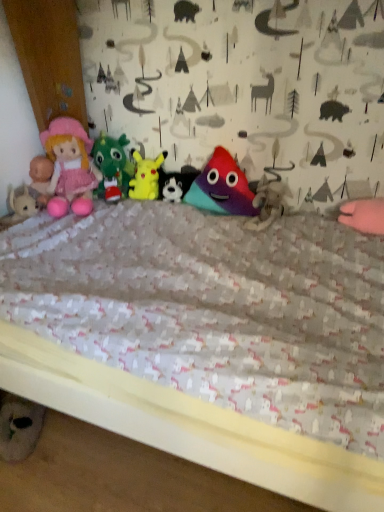
Find the location of a particular element. velvety green dragon at center, the 1th toy in the left-to-right sequence is located at coordinates (112, 167).

What do you see at coordinates (176, 183) in the screenshot?
I see `matte plastic pyramid at center, arranged as the 3th toy when viewed from the right` at bounding box center [176, 183].

What do you see at coordinates (267, 203) in the screenshot? Image resolution: width=384 pixels, height=512 pixels. I see `multicolored fabric triangle at center, acting as the 1th toy starting from the right` at bounding box center [267, 203].

What is the approximate width of pink plush doll at left?

31.16 centimeters.

What are the coordinates of `pink plush doll at left` in the screenshot? It's located at (70, 167).

This screenshot has height=512, width=384. What do you see at coordinates (222, 187) in the screenshot?
I see `multicolored plush triangle at center, which appears as the 4th toy when viewed from the left` at bounding box center [222, 187].

What is the approximate width of multicolored plush triangle at center, which appears as the 4th toy when viewed from the left?

The width of multicolored plush triangle at center, which appears as the 4th toy when viewed from the left, is 13.99 centimeters.

The height and width of the screenshot is (512, 384). Identify the location of velvety green dragon at center, which is counted as the 5th toy, starting from the right. (112, 167).

Is matte plastic pyramid at center, arranged as the 3th toy when viewed from the right, to the right of pink plush doll at left from the viewer's perspective?

Correct, you'll find matte plastic pyramid at center, arranged as the 3th toy when viewed from the right, to the right of pink plush doll at left.

Considering the points (193, 167) and (61, 122), which point is in front, point (193, 167) or point (61, 122)?

Positioned in front is point (61, 122).

Would you say pink plush doll at left is part of matte plastic pyramid at center, marked as the 3th toy in a left-to-right arrangement,'s contents?

Definitely not — pink plush doll at left is not inside matte plastic pyramid at center, marked as the 3th toy in a left-to-right arrangement.

Find the location of a particular element. the 3rd toy behind when counting from the pink plush doll at left is located at coordinates (176, 183).

Considering the sizes of objects yellow plush at center, which is the second toy in left-to-right order, and multicolored fabric triangle at center, which is counted as the fifth toy, starting from the left, in the image provided, who is wider, yellow plush at center, which is the second toy in left-to-right order, or multicolored fabric triangle at center, which is counted as the fifth toy, starting from the left,?

With larger width is multicolored fabric triangle at center, which is counted as the fifth toy, starting from the left.

Based on the photo, are yellow plush at center, marked as the 4th toy in a right-to-left arrangement, and multicolored fabric triangle at center, acting as the 1th toy starting from the right, located far from each other?

They are positioned close to each other.

Which is behind, yellow plush at center, which is the second toy in left-to-right order, or multicolored fabric triangle at center, which is counted as the fifth toy, starting from the left?

yellow plush at center, which is the second toy in left-to-right order, is further from the camera.

Which object is positioned more to the right, yellow plush at center, which is the second toy in left-to-right order, or multicolored fabric triangle at center, which is counted as the fifth toy, starting from the left?

multicolored fabric triangle at center, which is counted as the fifth toy, starting from the left, is more to the right.

Can you confirm if matte plastic pyramid at center, arranged as the 3th toy when viewed from the right, is positioned to the right of velvety green dragon at center, the 1th toy in the left-to-right sequence?

Yes.

From a real-world perspective, is matte plastic pyramid at center, marked as the 3th toy in a left-to-right arrangement, located beneath velvety green dragon at center, which is counted as the 5th toy, starting from the right?

Yes, from a real-world perspective, matte plastic pyramid at center, marked as the 3th toy in a left-to-right arrangement, is under velvety green dragon at center, which is counted as the 5th toy, starting from the right.

Measure the distance from matte plastic pyramid at center, arranged as the 3th toy when viewed from the right, to velvety green dragon at center, which is counted as the 5th toy, starting from the right.

matte plastic pyramid at center, arranged as the 3th toy when viewed from the right, and velvety green dragon at center, which is counted as the 5th toy, starting from the right, are 7.79 inches apart from each other.

In terms of height, does matte plastic pyramid at center, marked as the 3th toy in a left-to-right arrangement, look taller or shorter compared to velvety green dragon at center, the 1th toy in the left-to-right sequence?

In the image, matte plastic pyramid at center, marked as the 3th toy in a left-to-right arrangement, appears to be shorter than velvety green dragon at center, the 1th toy in the left-to-right sequence.

Between velvety green dragon at center, which is counted as the 5th toy, starting from the right, and pink plush doll at left, which one has smaller size?

With smaller size is velvety green dragon at center, which is counted as the 5th toy, starting from the right.

Which object is more forward, velvety green dragon at center, which is counted as the 5th toy, starting from the right, or pink plush doll at left?

pink plush doll at left is in front.

Consider the image. Does velvety green dragon at center, which is counted as the 5th toy, starting from the right, have a greater height compared to pink plush doll at left?

Incorrect, the height of velvety green dragon at center, which is counted as the 5th toy, starting from the right, is not larger of that of pink plush doll at left.

How many degrees apart are the facing directions of velvety green dragon at center, the 1th toy in the left-to-right sequence, and matte plastic pyramid at center, arranged as the 3th toy when viewed from the right?

The angular difference between velvety green dragon at center, the 1th toy in the left-to-right sequence, and matte plastic pyramid at center, arranged as the 3th toy when viewed from the right, is 1.43 degrees.

From the image's perspective, is velvety green dragon at center, the 1th toy in the left-to-right sequence, positioned above or below matte plastic pyramid at center, arranged as the 3th toy when viewed from the right?

Based on their image positions, velvety green dragon at center, the 1th toy in the left-to-right sequence, is located above matte plastic pyramid at center, arranged as the 3th toy when viewed from the right.

From a real-world perspective, who is located lower, velvety green dragon at center, which is counted as the 5th toy, starting from the right, or matte plastic pyramid at center, arranged as the 3th toy when viewed from the right?

From a 3D spatial view, matte plastic pyramid at center, arranged as the 3th toy when viewed from the right, is below.

Is multicolored plush triangle at center, the 2th toy positioned from the right, inside the boundaries of pink plush doll at left, or outside?

multicolored plush triangle at center, the 2th toy positioned from the right, is not enclosed by pink plush doll at left.

From the image's perspective, is multicolored plush triangle at center, which appears as the 4th toy when viewed from the left, below pink plush doll at left?

Correct, multicolored plush triangle at center, which appears as the 4th toy when viewed from the left, appears lower than pink plush doll at left in the image.

From a real-world perspective, is multicolored plush triangle at center, which appears as the 4th toy when viewed from the left, located beneath pink plush doll at left?

Yes.

Does multicolored plush triangle at center, which appears as the 4th toy when viewed from the left, come behind pink plush doll at left?

Yes.

From a real-world perspective, is yellow plush at center, marked as the 4th toy in a right-to-left arrangement, below pink plush doll at left?

Yes, from a real-world perspective, yellow plush at center, marked as the 4th toy in a right-to-left arrangement, is below pink plush doll at left.

In terms of size, does yellow plush at center, which is the second toy in left-to-right order, appear bigger or smaller than pink plush doll at left?

In the image, yellow plush at center, which is the second toy in left-to-right order, appears to be smaller than pink plush doll at left.

In the scene shown: Does yellow plush at center, marked as the 4th toy in a right-to-left arrangement, turn towards pink plush doll at left?

No, yellow plush at center, marked as the 4th toy in a right-to-left arrangement, does not turn towards pink plush doll at left.

Find the location of `person in front of the matte plastic pyramid at center, arranged as the 3th toy when viewed from the right`. person in front of the matte plastic pyramid at center, arranged as the 3th toy when viewed from the right is located at coordinates (70, 167).

Image resolution: width=384 pixels, height=512 pixels. I want to click on the 3rd toy below the yellow plush at center, which is the second toy in left-to-right order (from the image's perspective), so coord(267,203).

Based on their spatial positions, is multicolored fabric triangle at center, which is counted as the fifth toy, starting from the left, or yellow plush at center, marked as the 4th toy in a right-to-left arrangement, closer to pink plush doll at left?

yellow plush at center, marked as the 4th toy in a right-to-left arrangement, is closer to pink plush doll at left.

Which object lies nearer to the anchor point matte plastic pyramid at center, arranged as the 3th toy when viewed from the right, multicolored fabric triangle at center, acting as the 1th toy starting from the right, or yellow plush at center, marked as the 4th toy in a right-to-left arrangement?

Among the two, yellow plush at center, marked as the 4th toy in a right-to-left arrangement, is located nearer to matte plastic pyramid at center, arranged as the 3th toy when viewed from the right.

From the image, which object appears to be nearer to multicolored plush triangle at center, the 2th toy positioned from the right, multicolored fabric triangle at center, which is counted as the fifth toy, starting from the left, or velvety green dragon at center, which is counted as the 5th toy, starting from the right?

Among the two, multicolored fabric triangle at center, which is counted as the fifth toy, starting from the left, is located nearer to multicolored plush triangle at center, the 2th toy positioned from the right.

Looking at the image, which one is located closer to yellow plush at center, marked as the 4th toy in a right-to-left arrangement, multicolored fabric triangle at center, acting as the 1th toy starting from the right, or velvety green dragon at center, the 1th toy in the left-to-right sequence?

velvety green dragon at center, the 1th toy in the left-to-right sequence, is positioned closer to the anchor yellow plush at center, marked as the 4th toy in a right-to-left arrangement.

When comparing their distances from multicolored fabric triangle at center, which is counted as the fifth toy, starting from the left, does yellow plush at center, marked as the 4th toy in a right-to-left arrangement, or pink plush doll at left seem further?

Among the two, pink plush doll at left is located further to multicolored fabric triangle at center, which is counted as the fifth toy, starting from the left.

Which object lies nearer to the anchor point multicolored plush triangle at center, the 2th toy positioned from the right, matte plastic pyramid at center, marked as the 3th toy in a left-to-right arrangement, or yellow plush at center, marked as the 4th toy in a right-to-left arrangement?

Among the two, matte plastic pyramid at center, marked as the 3th toy in a left-to-right arrangement, is located nearer to multicolored plush triangle at center, the 2th toy positioned from the right.

From the image, which object appears to be nearer to pink plush doll at left, multicolored fabric triangle at center, which is counted as the fifth toy, starting from the left, or matte plastic pyramid at center, arranged as the 3th toy when viewed from the right?

matte plastic pyramid at center, arranged as the 3th toy when viewed from the right.

Based on their spatial positions, is multicolored fabric triangle at center, acting as the 1th toy starting from the right, or pink plush doll at left closer to velvety green dragon at center, which is counted as the 5th toy, starting from the right?

pink plush doll at left is positioned closer to the anchor velvety green dragon at center, which is counted as the 5th toy, starting from the right.

Locate an element on the screen. Image resolution: width=384 pixels, height=512 pixels. toy situated between matte plastic pyramid at center, arranged as the 3th toy when viewed from the right, and multicolored fabric triangle at center, which is counted as the fifth toy, starting from the left, from left to right is located at coordinates (222, 187).

The width and height of the screenshot is (384, 512). In order to click on toy situated between velvety green dragon at center, which is counted as the 5th toy, starting from the right, and matte plastic pyramid at center, marked as the 3th toy in a left-to-right arrangement, from left to right in this screenshot , I will do `click(146, 177)`.

Locate an element on the screen. This screenshot has width=384, height=512. toy between pink plush doll at left and yellow plush at center, marked as the 4th toy in a right-to-left arrangement is located at coordinates (112, 167).

Where is `toy located between yellow plush at center, which is the second toy in left-to-right order, and multicolored plush triangle at center, which appears as the 4th toy when viewed from the left, in the left-right direction`? Image resolution: width=384 pixels, height=512 pixels. toy located between yellow plush at center, which is the second toy in left-to-right order, and multicolored plush triangle at center, which appears as the 4th toy when viewed from the left, in the left-right direction is located at coordinates (176, 183).